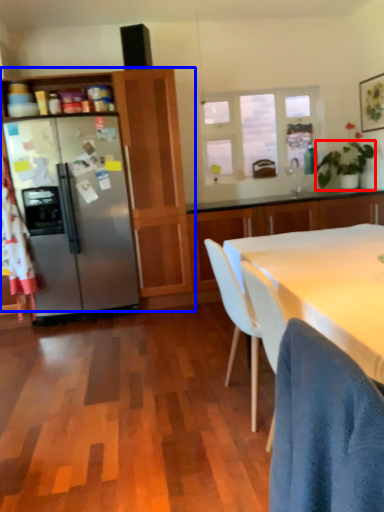
Question: Which object is closer to the camera taking this photo, houseplant (highlighted by a red box) or cabinetry (highlighted by a blue box)?

Choices:
 (A) houseplant
 (B) cabinetry

Answer: (B)